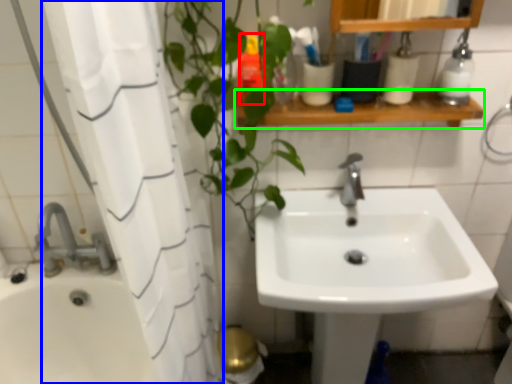
Question: Which object is the closest to the toiletry (highlighted by a red box)? Choose among these: shower curtain (highlighted by a blue box) or balustrade (highlighted by a green box).

Choices:
 (A) shower curtain
 (B) balustrade

Answer: (B)